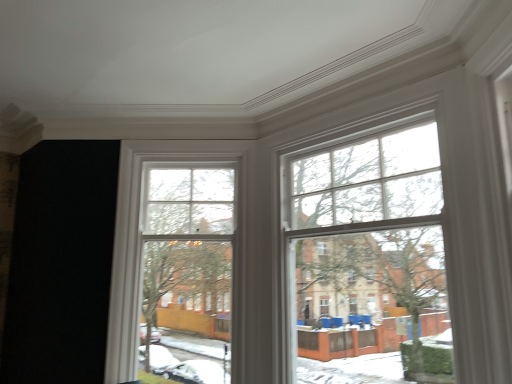
Question: Which direction should I rotate to face clear glass window at center, arranged as the first bay window when viewed from the left, — up or down?

Choices:
 (A) down
 (B) up

Answer: (A)

Question: From the image's perspective, is clear glass window at upper right, the 2th bay window from the left, beneath clear glass window at center, which is the 2th bay window from right to left?

Choices:
 (A) yes
 (B) no

Answer: (B)

Question: Is clear glass window at upper right, which appears as the first bay window when viewed from the right, at the right side of clear glass window at center, which is the 2th bay window from right to left?

Choices:
 (A) yes
 (B) no

Answer: (A)

Question: Can you confirm if clear glass window at upper right, which appears as the first bay window when viewed from the right, is shorter than clear glass window at center, which is the 2th bay window from right to left?

Choices:
 (A) yes
 (B) no

Answer: (A)

Question: Is the depth of clear glass window at upper right, the 2th bay window from the left, less than that of clear glass window at center, which is the 2th bay window from right to left?

Choices:
 (A) yes
 (B) no

Answer: (A)

Question: Considering the relative sizes of clear glass window at upper right, the 2th bay window from the left, and clear glass window at center, which is the 2th bay window from right to left, in the image provided, is clear glass window at upper right, the 2th bay window from the left, bigger than clear glass window at center, which is the 2th bay window from right to left,?

Choices:
 (A) yes
 (B) no

Answer: (A)

Question: Considering the relative positions of clear glass window at upper right, the 2th bay window from the left, and clear glass window at center, which is the 2th bay window from right to left, in the image provided, is clear glass window at upper right, the 2th bay window from the left, behind clear glass window at center, which is the 2th bay window from right to left,?

Choices:
 (A) yes
 (B) no

Answer: (B)

Question: From the image's perspective, is clear glass window at center, arranged as the first bay window when viewed from the left, beneath clear glass window at upper right, which appears as the first bay window when viewed from the right?

Choices:
 (A) no
 (B) yes

Answer: (B)

Question: Is clear glass window at center, arranged as the first bay window when viewed from the left, at the right side of clear glass window at upper right, which appears as the first bay window when viewed from the right?

Choices:
 (A) yes
 (B) no

Answer: (B)

Question: Is clear glass window at center, which is the 2th bay window from right to left, further to camera compared to clear glass window at upper right, which appears as the first bay window when viewed from the right?

Choices:
 (A) no
 (B) yes

Answer: (B)

Question: Does clear glass window at center, arranged as the first bay window when viewed from the left, have a larger size compared to clear glass window at upper right, which appears as the first bay window when viewed from the right?

Choices:
 (A) yes
 (B) no

Answer: (B)

Question: Is clear glass window at center, which is the 2th bay window from right to left, turned away from clear glass window at upper right, which appears as the first bay window when viewed from the right?

Choices:
 (A) no
 (B) yes

Answer: (A)

Question: Can you confirm if clear glass window at center, arranged as the first bay window when viewed from the left, is wider than clear glass window at upper right, which appears as the first bay window when viewed from the right?

Choices:
 (A) no
 (B) yes

Answer: (B)

Question: From a real-world perspective, is clear glass window at center, arranged as the first bay window when viewed from the left, physically located above or below clear glass window at upper right, the 2th bay window from the left?

Choices:
 (A) above
 (B) below

Answer: (B)